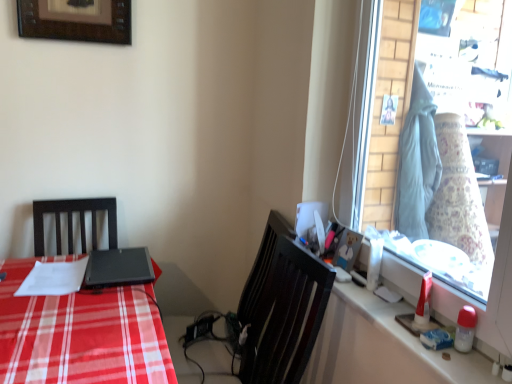
Question: Is white glossy counter top at right smaller than glass window at right?

Choices:
 (A) no
 (B) yes

Answer: (B)

Question: From the image's perspective, is white glossy counter top at right below glass window at right?

Choices:
 (A) yes
 (B) no

Answer: (A)

Question: Considering the relative sizes of white glossy counter top at right and glass window at right in the image provided, is white glossy counter top at right thinner than glass window at right?

Choices:
 (A) yes
 (B) no

Answer: (B)

Question: Is white glossy counter top at right far from glass window at right?

Choices:
 (A) yes
 (B) no

Answer: (B)

Question: Does white glossy counter top at right have a greater height compared to glass window at right?

Choices:
 (A) yes
 (B) no

Answer: (B)

Question: From the image's perspective, is white glossy counter top at right located above or below matte black desk at left?

Choices:
 (A) below
 (B) above

Answer: (B)

Question: Is white glossy counter top at right wider or thinner than matte black desk at left?

Choices:
 (A) thin
 (B) wide

Answer: (A)

Question: Relative to matte black desk at left, is white glossy counter top at right in front or behind?

Choices:
 (A) behind
 (B) front

Answer: (B)

Question: From a real-world perspective, relative to matte black desk at left, is white glossy counter top at right vertically above or below?

Choices:
 (A) below
 (B) above

Answer: (B)

Question: Based on their positions, is matte plastic picture frame at upper right, the 2th picture frame viewed from the left, located to the left or right of matte black desk at left?

Choices:
 (A) left
 (B) right

Answer: (B)

Question: From a real-world perspective, is matte plastic picture frame at upper right, the 2th picture frame viewed from the left, above or below matte black desk at left?

Choices:
 (A) above
 (B) below

Answer: (A)

Question: Is point (347, 243) closer or farther from the camera than point (20, 370)?

Choices:
 (A) farther
 (B) closer

Answer: (A)

Question: Considering their positions, is matte plastic picture frame at upper right, which is the 2th picture frame from back to front, located in front of or behind matte black desk at left?

Choices:
 (A) behind
 (B) front

Answer: (A)

Question: Is matte black desk at left taller or shorter than matte plastic picture frame at upper right, which ranks as the first picture frame in bottom-to-top order?

Choices:
 (A) short
 (B) tall

Answer: (B)

Question: Is point (91, 354) positioned closer to the camera than point (357, 244)?

Choices:
 (A) closer
 (B) farther

Answer: (A)